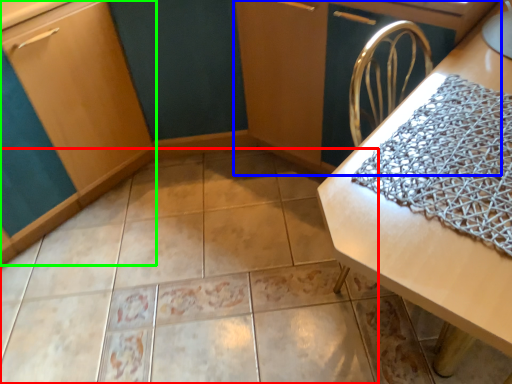
Question: Based on their relative distances, which object is farther from ceramic tile (highlighted by a red box)? Choose from dresser (highlighted by a blue box) and cabinetry (highlighted by a green box).

Choices:
 (A) dresser
 (B) cabinetry

Answer: (A)